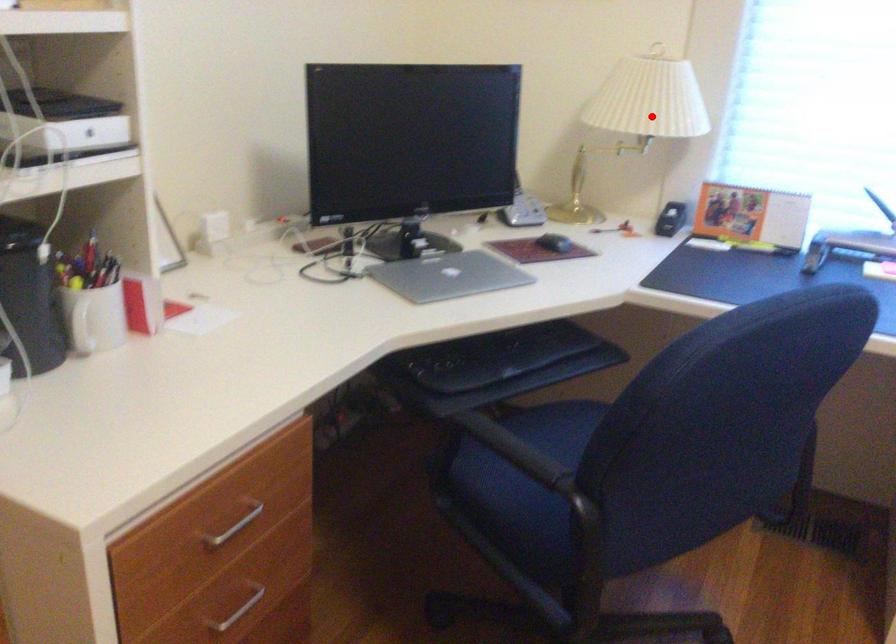
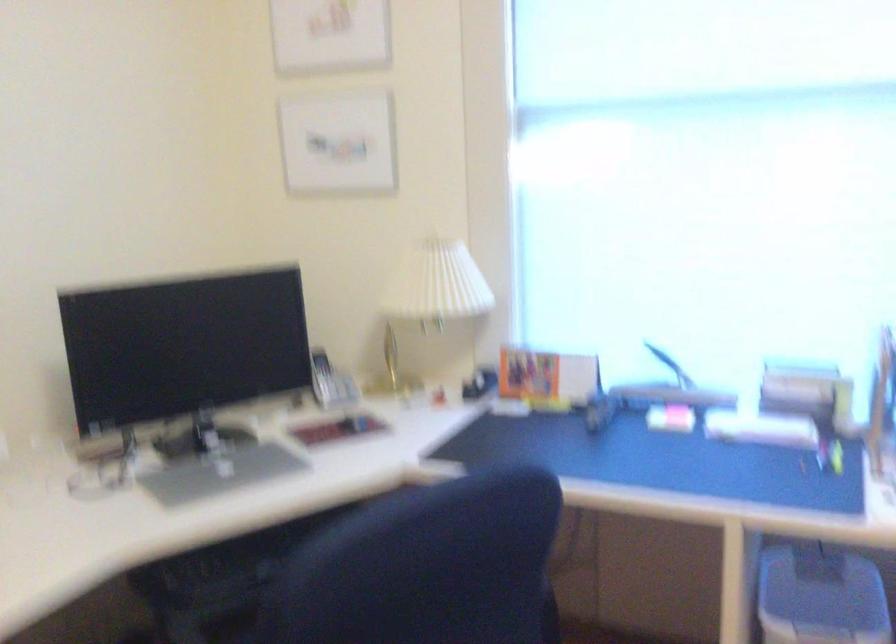
In the second image, find the point that corresponds to the highlighted location in the first image.

(433, 295)